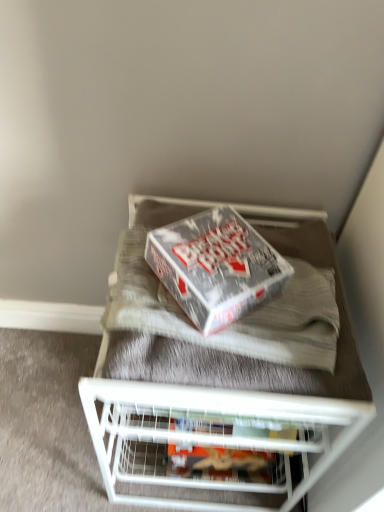
Image resolution: width=384 pixels, height=512 pixels. I want to click on free space above silver metallic box at center (from a real-world perspective), so click(208, 239).